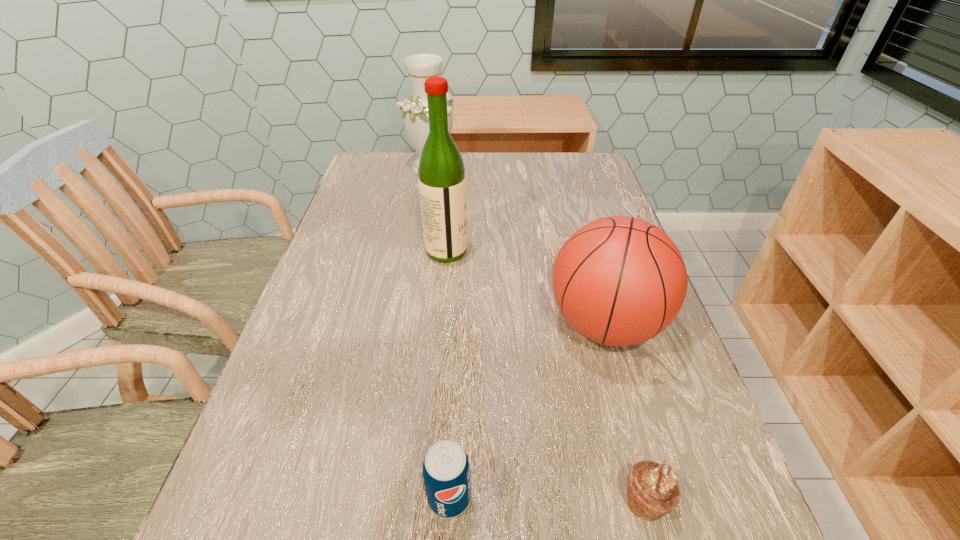
This screenshot has width=960, height=540. Find the location of `free space located 0.070m on the back of the basketball`. free space located 0.070m on the back of the basketball is located at coordinates (588, 265).

Identify the location of vacant space located 0.160m on the right of the pop. Image resolution: width=960 pixels, height=540 pixels. (578, 497).

Image resolution: width=960 pixels, height=540 pixels. Find the location of `vacant area located 0.300m on the left of the shortest object`. vacant area located 0.300m on the left of the shortest object is located at coordinates (420, 502).

This screenshot has height=540, width=960. Identify the location of object located at the far edge. (420, 67).

Identify the location of object present at the left edge. (420, 67).

Locate an element on the screen. The image size is (960, 540). basketball that is at the right edge is located at coordinates (619, 280).

Identify the location of muffin that is at the right edge. Image resolution: width=960 pixels, height=540 pixels. tap(653, 491).

Identify the location of object at the far left corner. The image size is (960, 540). (420, 67).

Image resolution: width=960 pixels, height=540 pixels. What are the coordinates of `free region at the far edge` in the screenshot? It's located at click(x=527, y=152).

You are a GUI agent. You are given a task and a screenshot of the screen. Output one action in this format:
    pyautogui.click(x=<x>, y=<y>)
    Task: Click on the vacant space at the left edge of the desktop
    Image resolution: width=960 pixels, height=540 pixels.
    Given the screenshot: What is the action you would take?
    pyautogui.click(x=339, y=245)